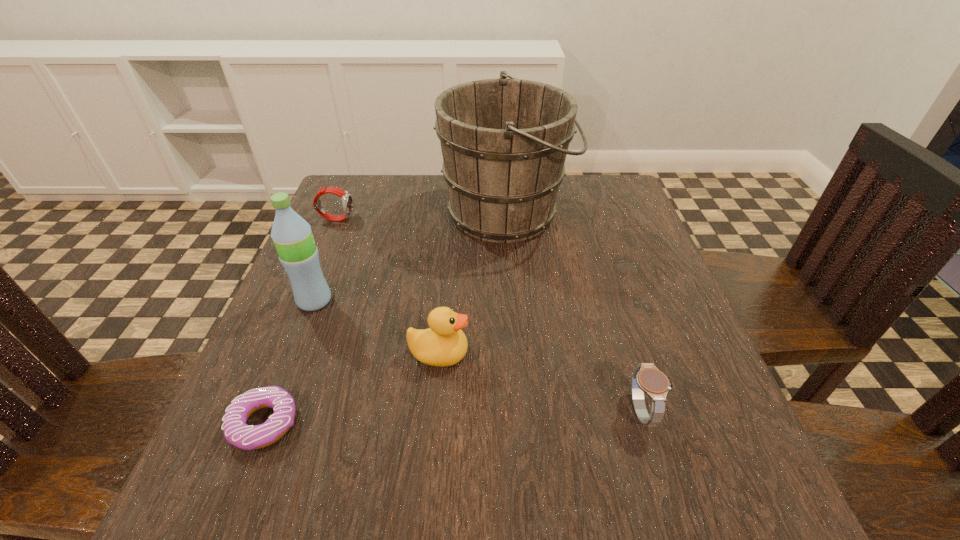
At what (x,y) coordinates should I click in order to perform the action: click on bucket. Please return your answer as a coordinate pair (x, y). This screenshot has width=960, height=540. Looking at the image, I should click on (504, 142).

Image resolution: width=960 pixels, height=540 pixels. I want to click on the fifth shortest object, so click(292, 236).

I want to click on water bottle, so click(292, 236).

Where is `the fourth shortest object`? the fourth shortest object is located at coordinates (443, 344).

Find the location of a particular element. The height and width of the screenshot is (540, 960). the fourth farthest object is located at coordinates (443, 344).

At what (x,y) coordinates should I click in order to perform the action: click on the left watch. Please return your answer as a coordinate pair (x, y). Looking at the image, I should click on (347, 202).

This screenshot has height=540, width=960. I want to click on the nearer watch, so click(x=647, y=378).

Identify the location of the shortest object. (236, 431).

Image resolution: width=960 pixels, height=540 pixels. Find the location of `vacant position located on the handle side of the tallest object`. vacant position located on the handle side of the tallest object is located at coordinates (625, 213).

What are the coordinates of `vacant space situated 0.270m on the front of the water bottle` in the screenshot? It's located at (256, 448).